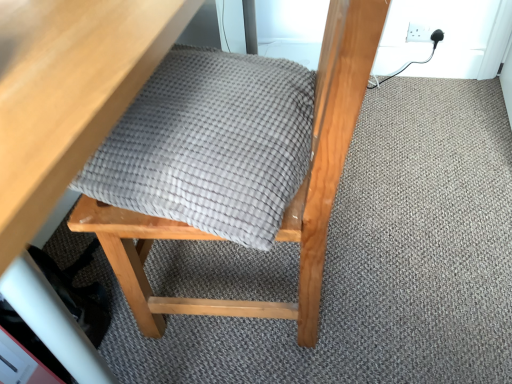
Question: Is wooden table at upper left placed right next to matte gray cushion at center?

Choices:
 (A) yes
 (B) no

Answer: (B)

Question: Is wooden table at upper left bigger than matte gray cushion at center?

Choices:
 (A) no
 (B) yes

Answer: (B)

Question: Is wooden table at upper left shorter than matte gray cushion at center?

Choices:
 (A) no
 (B) yes

Answer: (B)

Question: From the image's perspective, is wooden table at upper left above matte gray cushion at center?

Choices:
 (A) no
 (B) yes

Answer: (B)

Question: Is matte gray cushion at center at the back of wooden table at upper left?

Choices:
 (A) no
 (B) yes

Answer: (B)

Question: Can you confirm if wooden table at upper left is wider than matte gray cushion at center?

Choices:
 (A) yes
 (B) no

Answer: (A)

Question: Does gray woven blanket at center have a larger size compared to wooden table at upper left?

Choices:
 (A) yes
 (B) no

Answer: (B)

Question: Is gray woven blanket at center at the left side of wooden table at upper left?

Choices:
 (A) no
 (B) yes

Answer: (A)

Question: Can you confirm if gray woven blanket at center is wider than wooden table at upper left?

Choices:
 (A) no
 (B) yes

Answer: (A)

Question: Is gray woven blanket at center aimed at wooden table at upper left?

Choices:
 (A) no
 (B) yes

Answer: (B)

Question: Can you confirm if gray woven blanket at center is taller than wooden table at upper left?

Choices:
 (A) no
 (B) yes

Answer: (A)

Question: From the image's perspective, is gray woven blanket at center under wooden table at upper left?

Choices:
 (A) yes
 (B) no

Answer: (A)

Question: Is white plastic socket at upper right to the right of wooden table at upper left from the viewer's perspective?

Choices:
 (A) yes
 (B) no

Answer: (A)